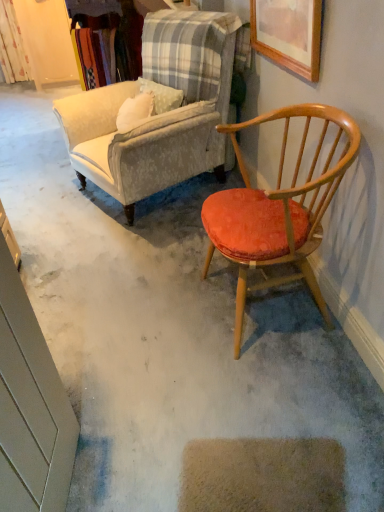
You are a GUI agent. You are given a task and a screenshot of the screen. Output one action in this format:
    pyautogui.click(x=<x>, y=<y>)
    Task: Click on the wooden picture frame at upper right
    This screenshot has height=512, width=384.
    Given the screenshot: What is the action you would take?
    pyautogui.click(x=288, y=34)

What do you see at coordinates (288, 34) in the screenshot?
I see `wooden picture frame at upper right` at bounding box center [288, 34].

At what (x,y) coordinates should I click in order to perform the action: click on wooden armchair with orange cushion at right, placed as the second chair when sorted from back to front. Please return your answer as a coordinate pair (x, y). Looking at the image, I should click on (277, 209).

What do you see at coordinates (277, 209) in the screenshot?
I see `wooden armchair with orange cushion at right, placed as the second chair when sorted from back to front` at bounding box center [277, 209].

Image resolution: width=384 pixels, height=512 pixels. Identify the location of wooden picture frame at upper right. (288, 34).

Which of these two, floral fabric curtain at upper left or velvet beige armchair at upper left, which is the 2th chair from front to back, stands taller?

velvet beige armchair at upper left, which is the 2th chair from front to back, is taller.

Are floral fabric curtain at upper left and velvet beige armchair at upper left, which is the 2th chair from front to back, far apart?

floral fabric curtain at upper left is far away from velvet beige armchair at upper left, which is the 2th chair from front to back.

Considering the relative sizes of floral fabric curtain at upper left and velvet beige armchair at upper left, the first chair when ordered from back to front, in the image provided, is floral fabric curtain at upper left thinner than velvet beige armchair at upper left, the first chair when ordered from back to front,?

Yes.

Measure the distance from floral fabric curtain at upper left to wooden picture frame at upper right.

floral fabric curtain at upper left is 12.74 feet away from wooden picture frame at upper right.

From the picture: Is floral fabric curtain at upper left oriented towards wooden picture frame at upper right?

No, floral fabric curtain at upper left does not turn towards wooden picture frame at upper right.

Consider the image. Between floral fabric curtain at upper left and wooden picture frame at upper right, which one has less height?

wooden picture frame at upper right is shorter.

At what (x,y) coordinates should I click in order to perform the action: click on curtain behind the wooden picture frame at upper right. Please return your answer as a coordinate pair (x, y). Looking at the image, I should click on (13, 46).

From the picture: Can you confirm if wooden armchair with orange cushion at right, placed as the second chair when sorted from back to front, is positioned to the right of velvet beige armchair at upper left, which is the 2th chair from front to back?

Correct, you'll find wooden armchair with orange cushion at right, placed as the second chair when sorted from back to front, to the right of velvet beige armchair at upper left, which is the 2th chair from front to back.

Does wooden armchair with orange cushion at right, placed as the second chair when sorted from back to front, have a greater height compared to velvet beige armchair at upper left, the first chair when ordered from back to front?

In fact, wooden armchair with orange cushion at right, placed as the second chair when sorted from back to front, may be shorter than velvet beige armchair at upper left, the first chair when ordered from back to front.

In the scene shown: From a real-world perspective, which object stands above the other?

velvet beige armchair at upper left, which is the 2th chair from front to back, from a real-world perspective.

Can you confirm if wooden armchair with orange cushion at right, placed as the second chair when sorted from back to front, is wider than wooden picture frame at upper right?

Correct, the width of wooden armchair with orange cushion at right, placed as the second chair when sorted from back to front, exceeds that of wooden picture frame at upper right.

Is wooden armchair with orange cushion at right, positioned as the 1th chair in front-to-back order, oriented towards wooden picture frame at upper right?

No, wooden armchair with orange cushion at right, positioned as the 1th chair in front-to-back order, does not turn towards wooden picture frame at upper right.

Which point is more distant from viewer, [301,264] or [265,21]?

The point [265,21] is farther.

How many degrees apart are the facing directions of wooden armchair with orange cushion at right, positioned as the 1th chair in front-to-back order, and wooden picture frame at upper right?

0.000825 degrees separate the facing orientations of wooden armchair with orange cushion at right, positioned as the 1th chair in front-to-back order, and wooden picture frame at upper right.

Can you confirm if velvet beige armchair at upper left, the first chair when ordered from back to front, is shorter than wooden armchair with orange cushion at right, placed as the second chair when sorted from back to front?

In fact, velvet beige armchair at upper left, the first chair when ordered from back to front, may be taller than wooden armchair with orange cushion at right, placed as the second chair when sorted from back to front.

Can you confirm if velvet beige armchair at upper left, which is the 2th chair from front to back, is positioned to the right of wooden armchair with orange cushion at right, positioned as the 1th chair in front-to-back order?

No.

This screenshot has width=384, height=512. I want to click on chair beneath the velvet beige armchair at upper left, which is the 2th chair from front to back (from a real-world perspective), so click(x=277, y=209).

Is velvet beige armchair at upper left, which is the 2th chair from front to back, thinner than wooden armchair with orange cushion at right, placed as the second chair when sorted from back to front?

Incorrect, the width of velvet beige armchair at upper left, which is the 2th chair from front to back, is not less than that of wooden armchair with orange cushion at right, placed as the second chair when sorted from back to front.

From the image's perspective, is floral fabric curtain at upper left on top of wooden armchair with orange cushion at right, positioned as the 1th chair in front-to-back order?

Yes, from the image's perspective, floral fabric curtain at upper left is on top of wooden armchair with orange cushion at right, positioned as the 1th chair in front-to-back order.

Is floral fabric curtain at upper left positioned with its back to wooden armchair with orange cushion at right, positioned as the 1th chair in front-to-back order?

No, floral fabric curtain at upper left is not facing the opposite direction of wooden armchair with orange cushion at right, positioned as the 1th chair in front-to-back order.

Is point (20, 44) closer to viewer compared to point (347, 117)?

No, (20, 44) is behind (347, 117).

Is floral fabric curtain at upper left at the right side of wooden armchair with orange cushion at right, positioned as the 1th chair in front-to-back order?

No, floral fabric curtain at upper left is not to the right of wooden armchair with orange cushion at right, positioned as the 1th chair in front-to-back order.

Is wooden picture frame at upper right aimed at velvet beige armchair at upper left, the first chair when ordered from back to front?

Yes, wooden picture frame at upper right is oriented towards velvet beige armchair at upper left, the first chair when ordered from back to front.

Between wooden picture frame at upper right and velvet beige armchair at upper left, the first chair when ordered from back to front, which one has smaller width?

Thinner between the two is wooden picture frame at upper right.

Which of these two, wooden picture frame at upper right or velvet beige armchair at upper left, the first chair when ordered from back to front, stands taller?

With more height is velvet beige armchair at upper left, the first chair when ordered from back to front.

At what (x,y) coordinates should I click in order to perform the action: click on curtain that appears behind the velvet beige armchair at upper left, which is the 2th chair from front to back. Please return your answer as a coordinate pair (x, y). The image size is (384, 512). Looking at the image, I should click on pos(13,46).

I want to click on picture frame in front of the floral fabric curtain at upper left, so click(x=288, y=34).

From the picture: Considering their positions, is floral fabric curtain at upper left positioned further to wooden picture frame at upper right than wooden armchair with orange cushion at right, positioned as the 1th chair in front-to-back order?

Among the two, floral fabric curtain at upper left is located further to wooden picture frame at upper right.

Estimate the real-world distances between objects in this image. Which object is further from wooden picture frame at upper right, floral fabric curtain at upper left or velvet beige armchair at upper left, the first chair when ordered from back to front?

floral fabric curtain at upper left is positioned further to the anchor wooden picture frame at upper right.

When comparing their distances from velvet beige armchair at upper left, which is the 2th chair from front to back, does floral fabric curtain at upper left or wooden armchair with orange cushion at right, placed as the second chair when sorted from back to front, seem closer?

Based on the image, wooden armchair with orange cushion at right, placed as the second chair when sorted from back to front, appears to be nearer to velvet beige armchair at upper left, which is the 2th chair from front to back.

Looking at the image, which one is located closer to wooden armchair with orange cushion at right, positioned as the 1th chair in front-to-back order, wooden picture frame at upper right or velvet beige armchair at upper left, which is the 2th chair from front to back?

wooden picture frame at upper right is positioned closer to the anchor wooden armchair with orange cushion at right, positioned as the 1th chair in front-to-back order.

Based on their spatial positions, is floral fabric curtain at upper left or wooden picture frame at upper right further from wooden armchair with orange cushion at right, placed as the second chair when sorted from back to front?

Based on the image, floral fabric curtain at upper left appears to be further to wooden armchair with orange cushion at right, placed as the second chair when sorted from back to front.

Based on their spatial positions, is velvet beige armchair at upper left, the first chair when ordered from back to front, or wooden picture frame at upper right closer to wooden armchair with orange cushion at right, placed as the second chair when sorted from back to front?

wooden picture frame at upper right is positioned closer to the anchor wooden armchair with orange cushion at right, placed as the second chair when sorted from back to front.

Which object lies further to the anchor point velvet beige armchair at upper left, the first chair when ordered from back to front, wooden picture frame at upper right or floral fabric curtain at upper left?

floral fabric curtain at upper left is further to velvet beige armchair at upper left, the first chair when ordered from back to front.

Which object lies further to the anchor point wooden armchair with orange cushion at right, positioned as the 1th chair in front-to-back order, floral fabric curtain at upper left or velvet beige armchair at upper left, the first chair when ordered from back to front?

floral fabric curtain at upper left.

What are the coordinates of `chair between wooden armchair with orange cushion at right, positioned as the 1th chair in front-to-back order, and floral fabric curtain at upper left, along the z-axis` in the screenshot? It's located at (158, 114).

Locate an element on the screen. This screenshot has height=512, width=384. picture frame positioned between wooden armchair with orange cushion at right, placed as the second chair when sorted from back to front, and floral fabric curtain at upper left from near to far is located at coordinates (288, 34).

The image size is (384, 512). Identify the location of chair between wooden picture frame at upper right and floral fabric curtain at upper left in the front-back direction. (158, 114).

Where is `chair that lies between wooden picture frame at upper right and wooden armchair with orange cushion at right, positioned as the 1th chair in front-to-back order, from top to bottom`? Image resolution: width=384 pixels, height=512 pixels. chair that lies between wooden picture frame at upper right and wooden armchair with orange cushion at right, positioned as the 1th chair in front-to-back order, from top to bottom is located at coordinates (158, 114).